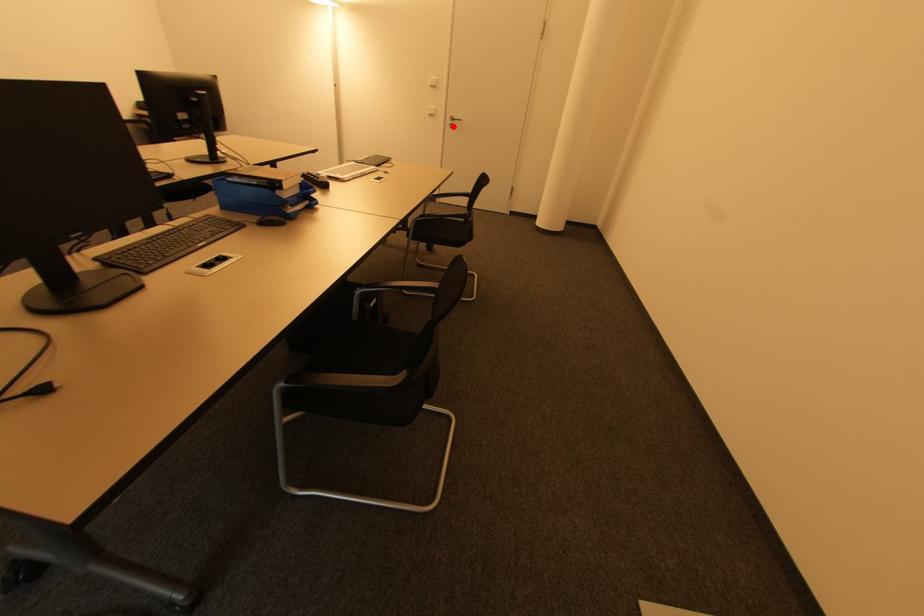
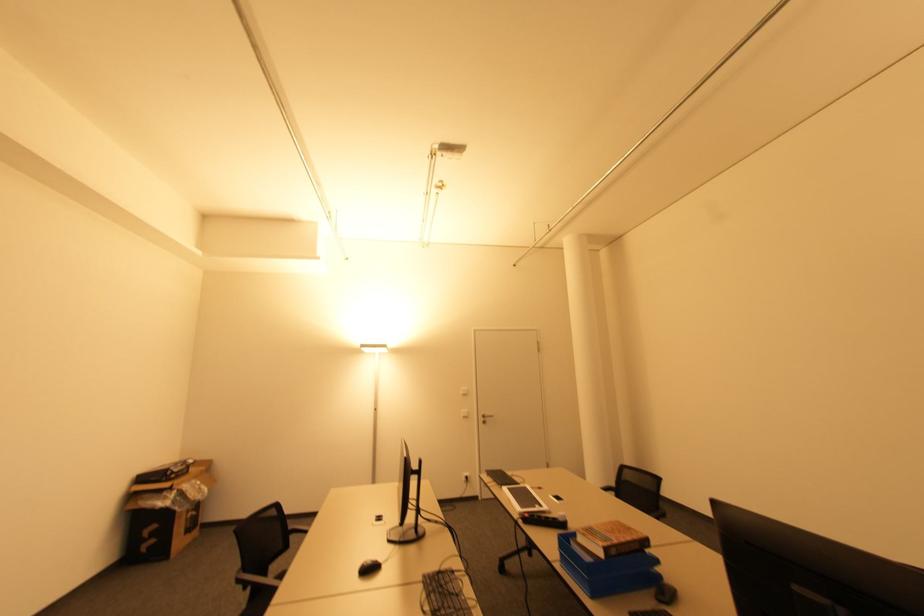
In the second image, find the point that corresponds to the highlighted location in the first image.

(485, 422)